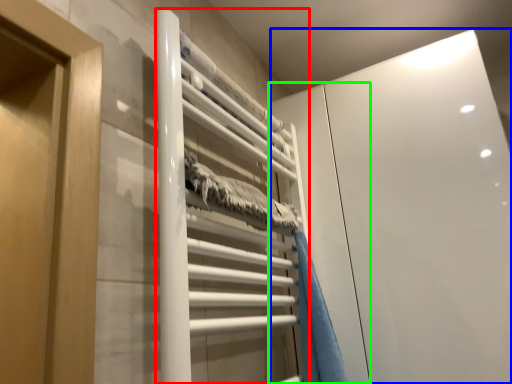
Question: Estimate the real-world distances between objects in this image. Which object is closer to stair (highlighted by a red box), glass door (highlighted by a blue box) or screen door (highlighted by a green box)?

Choices:
 (A) glass door
 (B) screen door

Answer: (B)